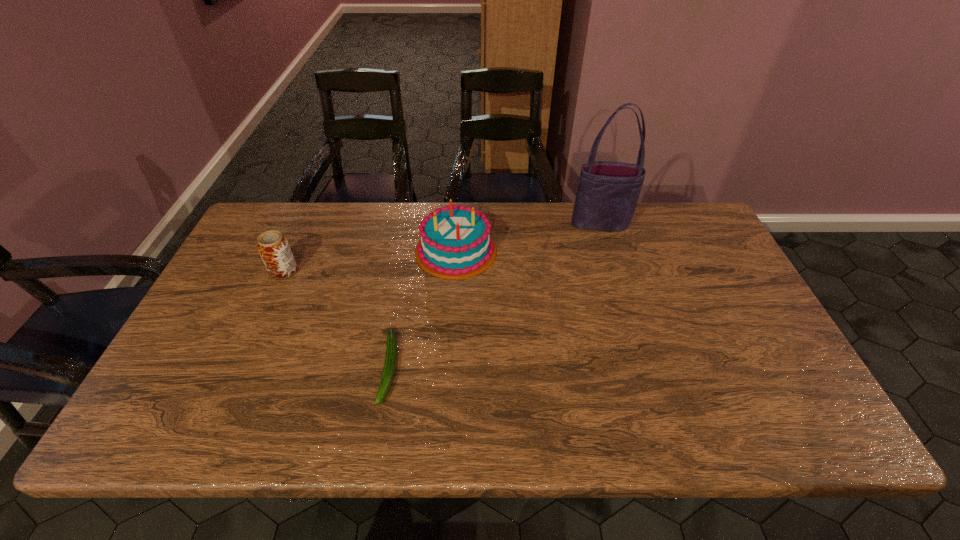
This screenshot has width=960, height=540. Identify the location of tote bag. (607, 195).

I want to click on the tallest object, so click(607, 195).

Find the location of `birthday cake`. birthday cake is located at coordinates (456, 242).

This screenshot has width=960, height=540. What are the coordinates of `beer can` in the screenshot? It's located at (273, 247).

This screenshot has width=960, height=540. Find the location of `the leftmost object`. the leftmost object is located at coordinates (273, 247).

At what (x,y) coordinates should I click in order to perform the action: click on the shortest object. Please return your answer as a coordinate pair (x, y). The image size is (960, 540). Looking at the image, I should click on (391, 342).

Identify the location of zucchini. This screenshot has height=540, width=960. (391, 342).

I want to click on vacant space located 0.090m on the front of the tote bag, so click(x=609, y=252).

This screenshot has width=960, height=540. I want to click on vacant space positioned on the front of the birthday cake, so click(453, 309).

Image resolution: width=960 pixels, height=540 pixels. Identify the location of vacant space located 0.220m on the front of the second shortest object. coord(252,343).